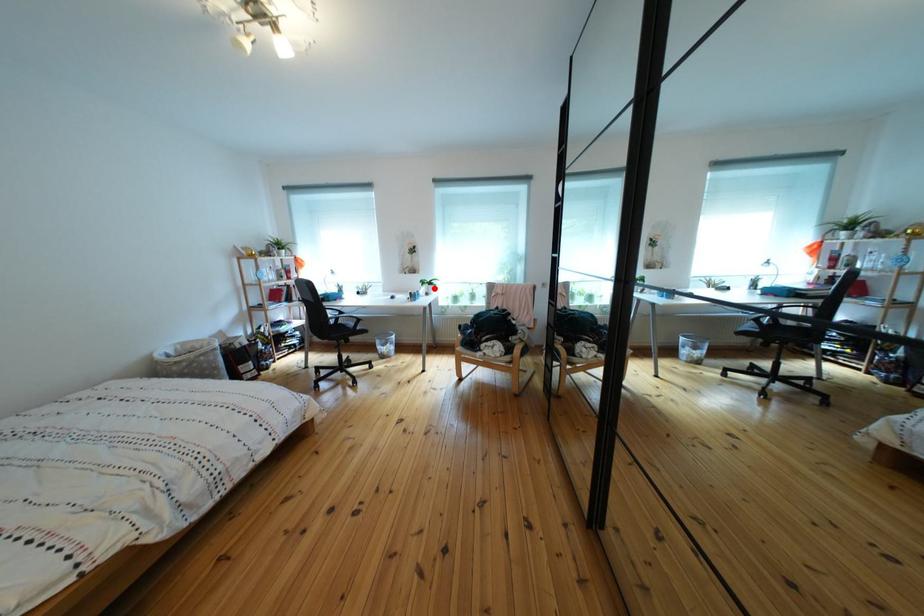
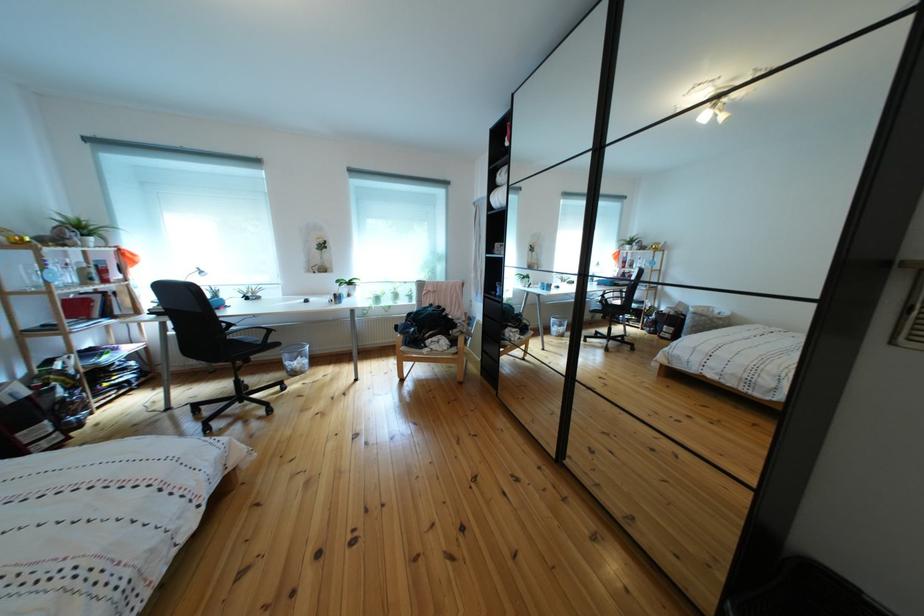
The point at the highlighted location is marked in the first image. Where is the corresponding point in the second image?

(351, 288)